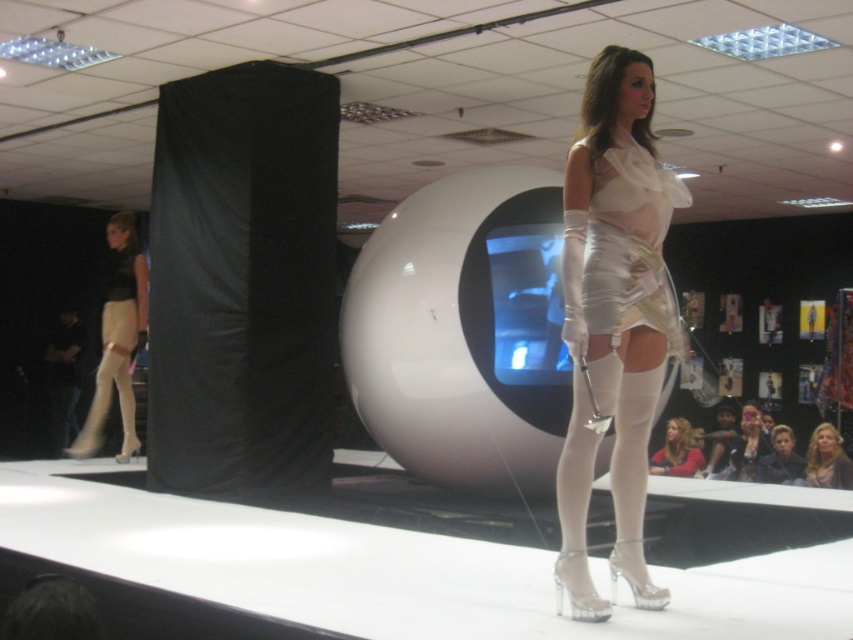
Question: Considering the relative positions of matte white stockings at left and matte black dress at center in the image provided, where is matte white stockings at left located with respect to matte black dress at center?

Choices:
 (A) left
 (B) right

Answer: (A)

Question: Is satin white dress at center wider than matte black dress at center?

Choices:
 (A) no
 (B) yes

Answer: (A)

Question: Can you confirm if blonde hair at center is positioned below matte white dress at center?

Choices:
 (A) yes
 (B) no

Answer: (B)

Question: Based on their relative distances, which object is nearer to the blonde hair at center?

Choices:
 (A) satin white dress at center
 (B) matte white dress at center
 (C) matte black dress at center

Answer: (C)

Question: Which point is farther to the camera?

Choices:
 (A) (611, 81)
 (B) (93, 400)
 (C) (688, 436)

Answer: (B)

Question: Which is nearer to the metallic silver dress at center?

Choices:
 (A) satin white dress at center
 (B) matte white stockings at left
 (C) blonde hair at center
 (D) matte white dress at center

Answer: (A)